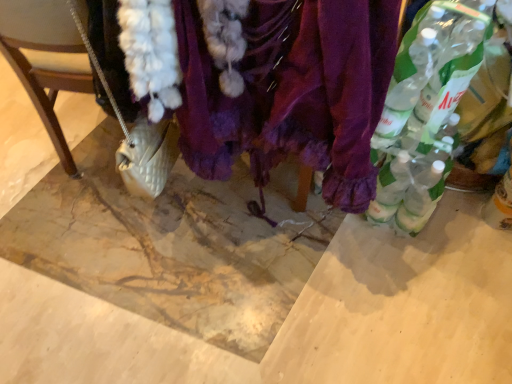
Question: Considering the relative sizes of purple velvet scarf at center and clear plastic bottles at right, acting as the 1th bottle starting from the left, in the image provided, is purple velvet scarf at center smaller than clear plastic bottles at right, acting as the 1th bottle starting from the left,?

Choices:
 (A) no
 (B) yes

Answer: (A)

Question: Can you confirm if purple velvet scarf at center is shorter than clear plastic bottles at right, which appears as the 3th bottle when viewed from the right?

Choices:
 (A) no
 (B) yes

Answer: (A)

Question: Could you tell me if purple velvet scarf at center is turned towards clear plastic bottles at right, which appears as the 3th bottle when viewed from the right?

Choices:
 (A) no
 (B) yes

Answer: (A)

Question: Does purple velvet scarf at center contain clear plastic bottles at right, acting as the 1th bottle starting from the left?

Choices:
 (A) yes
 (B) no

Answer: (A)

Question: Is the depth of purple velvet scarf at center greater than that of clear plastic bottles at right, which appears as the 3th bottle when viewed from the right?

Choices:
 (A) no
 (B) yes

Answer: (A)

Question: Considering the positions of clear plastic bottle at right, marked as the second bottle in a right-to-left arrangement, and clear plastic bottles at right, acting as the 1th bottle starting from the left, in the image, is clear plastic bottle at right, marked as the second bottle in a right-to-left arrangement, wider or thinner than clear plastic bottles at right, acting as the 1th bottle starting from the left,?

Choices:
 (A) wide
 (B) thin

Answer: (A)

Question: Considering their positions, is clear plastic bottle at right, marked as the second bottle in a right-to-left arrangement, located in front of or behind clear plastic bottles at right, which appears as the 3th bottle when viewed from the right?

Choices:
 (A) front
 (B) behind

Answer: (B)

Question: Would you say clear plastic bottle at right, marked as the second bottle in a right-to-left arrangement, is inside or outside clear plastic bottles at right, which appears as the 3th bottle when viewed from the right?

Choices:
 (A) inside
 (B) outside

Answer: (B)

Question: Is clear plastic bottle at right, the 2th bottle positioned from the left, to the left or to the right of clear plastic bottles at right, which appears as the 3th bottle when viewed from the right, in the image?

Choices:
 (A) left
 (B) right

Answer: (B)

Question: Is translucent plastic bottle at lower right, placed as the third bottle when sorted from left to right, taller or shorter than clear plastic bottle at right, marked as the second bottle in a right-to-left arrangement?

Choices:
 (A) tall
 (B) short

Answer: (B)

Question: From the image's perspective, is translucent plastic bottle at lower right, the first bottle from the right, located above or below clear plastic bottle at right, marked as the second bottle in a right-to-left arrangement?

Choices:
 (A) below
 (B) above

Answer: (A)

Question: Is translucent plastic bottle at lower right, the first bottle from the right, to the left or to the right of clear plastic bottle at right, marked as the second bottle in a right-to-left arrangement, in the image?

Choices:
 (A) right
 (B) left

Answer: (A)

Question: Is point (494, 220) positioned closer to the camera than point (416, 112)?

Choices:
 (A) farther
 (B) closer

Answer: (A)

Question: Looking at the image, does clear plastic bottle at right, the 2th bottle positioned from the left, seem bigger or smaller compared to purple velvet scarf at center?

Choices:
 (A) big
 (B) small

Answer: (B)

Question: Is clear plastic bottle at right, the 2th bottle positioned from the left, inside the boundaries of purple velvet scarf at center, or outside?

Choices:
 (A) inside
 (B) outside

Answer: (B)